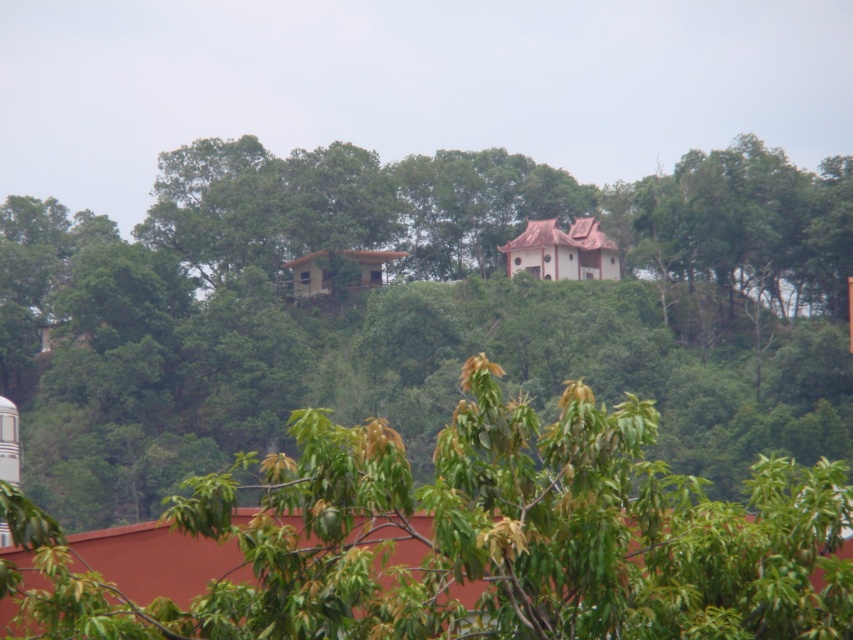
Can you confirm if green leafy tree at upper center is positioned above green leafy tree at center?

Correct, green leafy tree at upper center is located above green leafy tree at center.

Who is more distant from viewer, (135, 486) or (340, 576)?

Point (135, 486)

Image resolution: width=853 pixels, height=640 pixels. What are the coordinates of `green leafy tree at upper center` in the screenshot? It's located at (416, 310).